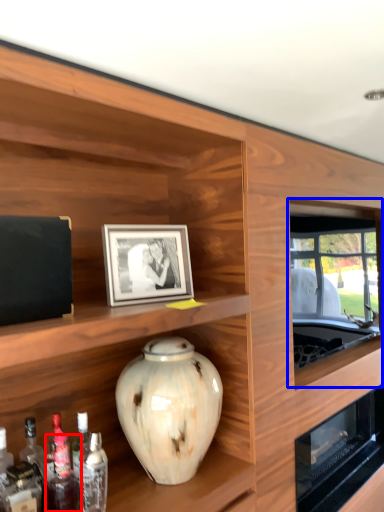
Question: Which of the following is the closest to the observer, bottle (highlighted by a red box) or window (highlighted by a blue box)?

Choices:
 (A) bottle
 (B) window

Answer: (A)